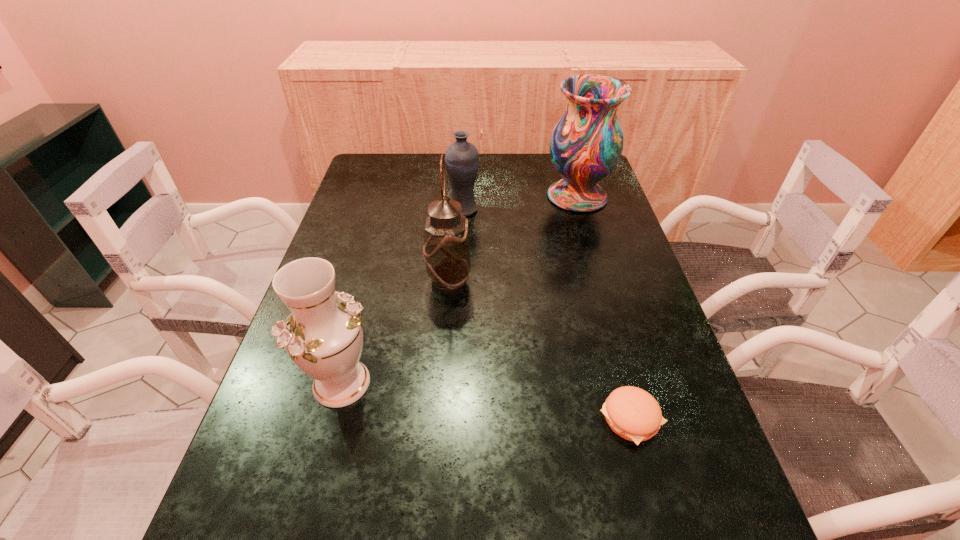
The width and height of the screenshot is (960, 540). Find the location of `vacant position located on the right of the shortest vase`. vacant position located on the right of the shortest vase is located at coordinates (546, 208).

Where is `free point located 0.400m on the left of the shortest object`? The image size is (960, 540). free point located 0.400m on the left of the shortest object is located at coordinates [394, 418].

This screenshot has height=540, width=960. Find the location of `object at the far edge`. object at the far edge is located at coordinates (586, 144).

Image resolution: width=960 pixels, height=540 pixels. Identify the location of object at the left edge. (323, 335).

At what (x,y) coordinates should I click in order to perform the action: click on vase at the right edge. Please return your answer as a coordinate pair (x, y). This screenshot has height=540, width=960. Looking at the image, I should click on (586, 144).

Locate an element on the screen. This screenshot has height=540, width=960. patty situated at the right edge is located at coordinates (632, 413).

Find the location of `object present at the far right corner`. object present at the far right corner is located at coordinates (586, 144).

In the image, there is a desktop. At what (x,y) coordinates should I click in order to perform the action: click on vacant region at the far edge. Please return your answer as a coordinate pair (x, y). The height and width of the screenshot is (540, 960). Looking at the image, I should click on (499, 173).

In the image, there is a desktop. Identify the location of vacant area at the left edge. Image resolution: width=960 pixels, height=540 pixels. (364, 206).

You are a GUI agent. You are given a task and a screenshot of the screen. Output one action in this format:
    pyautogui.click(x=<x>, y=<y>)
    Task: Click on the vacant space at the right edge
    This screenshot has height=540, width=960.
    Given the screenshot: What is the action you would take?
    pyautogui.click(x=699, y=503)